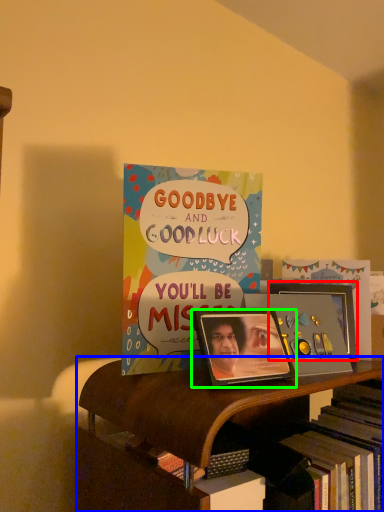
Question: Considering the real-world distances, which object is farthest from picture frame (highlighted by a red box)? shelf (highlighted by a blue box) or picture frame (highlighted by a green box)?

Choices:
 (A) shelf
 (B) picture frame

Answer: (A)